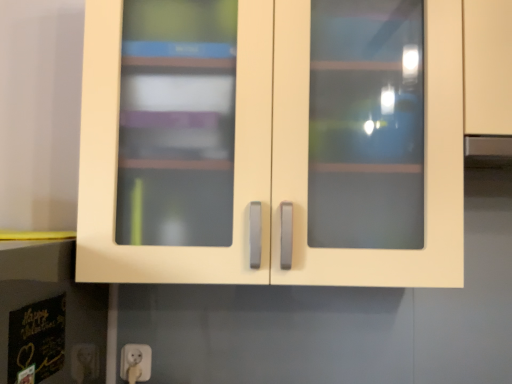
What do you see at coordinates (274, 144) in the screenshot?
I see `matte cream cupboard at center` at bounding box center [274, 144].

This screenshot has width=512, height=384. Identify the location of matte cream cupboard at center. (274, 144).

This screenshot has height=384, width=512. Find the location of `matte cream cupboard at center`. matte cream cupboard at center is located at coordinates (274, 144).